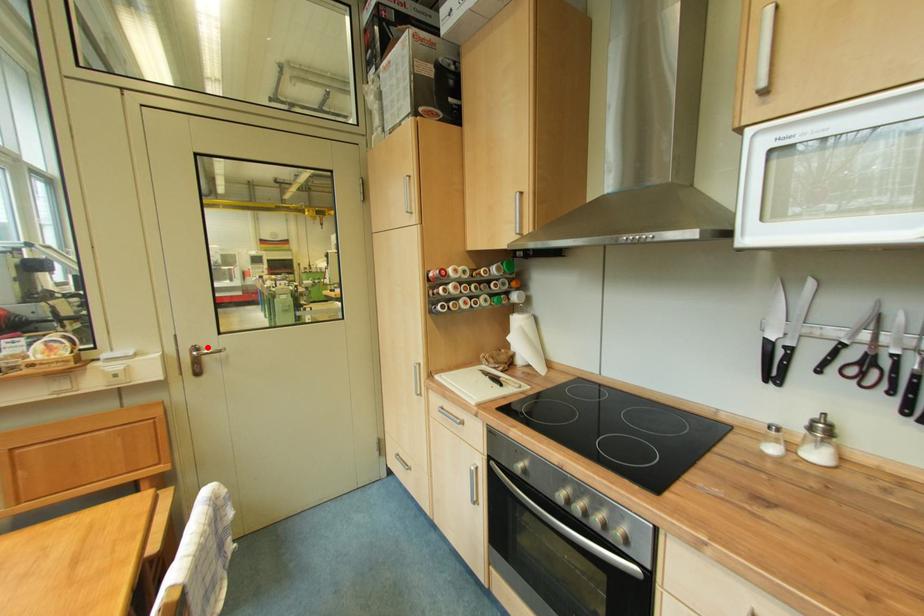
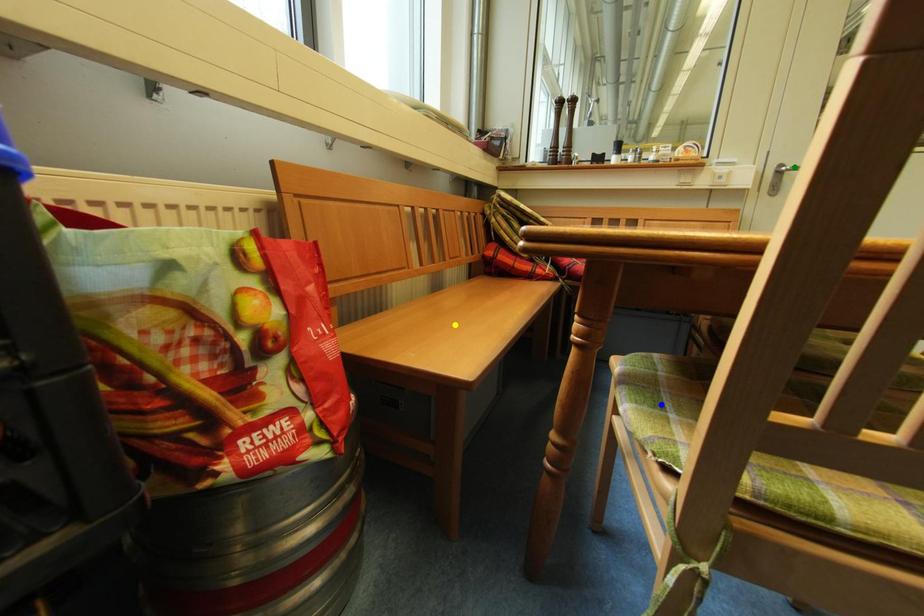
Question: I am providing you with two images of the same scene from different viewpoints. A red point is marked on the first image. You are given multiple points on the second image. Can you choose the point in image 2 that corresponds to the point in image 1?

Choices:
 (A) yellow point
 (B) green point
 (C) blue point

Answer: (B)